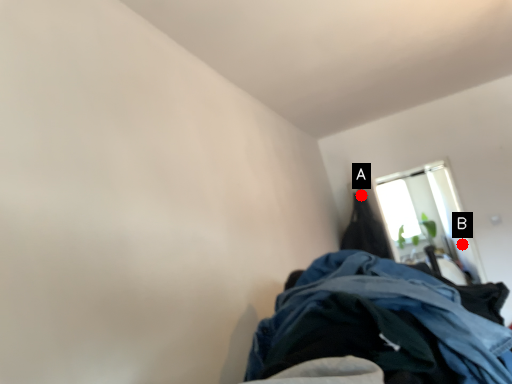
Question: Two points are circled on the image, labeled by A and B beside each circle. Which point appears farthest from the camera in this image?

Choices:
 (A) A is further
 (B) B is further

Answer: (B)